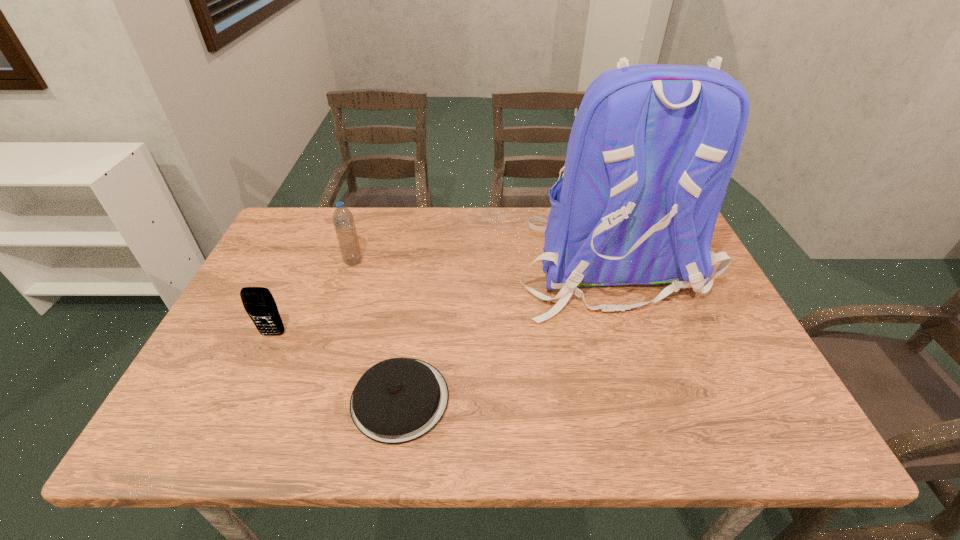
In order to click on free location located 0.170m on the screen of the leftmost object in this screenshot , I will do `click(242, 402)`.

The image size is (960, 540). I want to click on free spot located on the back of the pancake, so click(x=418, y=282).

Identify the location of object at the far edge. This screenshot has width=960, height=540. (652, 148).

Find the location of a particular element. The height and width of the screenshot is (540, 960). object present at the near edge is located at coordinates (398, 400).

Locate an element on the screen. The image size is (960, 540). object that is at the left edge is located at coordinates coord(258,302).

Find the location of a particular element. This screenshot has height=540, width=960. object located in the right edge section of the desktop is located at coordinates (652, 148).

At what (x,y) coordinates should I click in order to perform the action: click on object located in the far right corner section of the desktop. Please return your answer as a coordinate pair (x, y). The image size is (960, 540). Looking at the image, I should click on (652, 148).

Locate an element on the screen. This screenshot has width=960, height=540. vacant space at the far edge is located at coordinates (400, 244).

I want to click on vacant space at the left edge of the desktop, so click(277, 286).

This screenshot has height=540, width=960. I want to click on free space at the far left corner, so click(x=334, y=211).